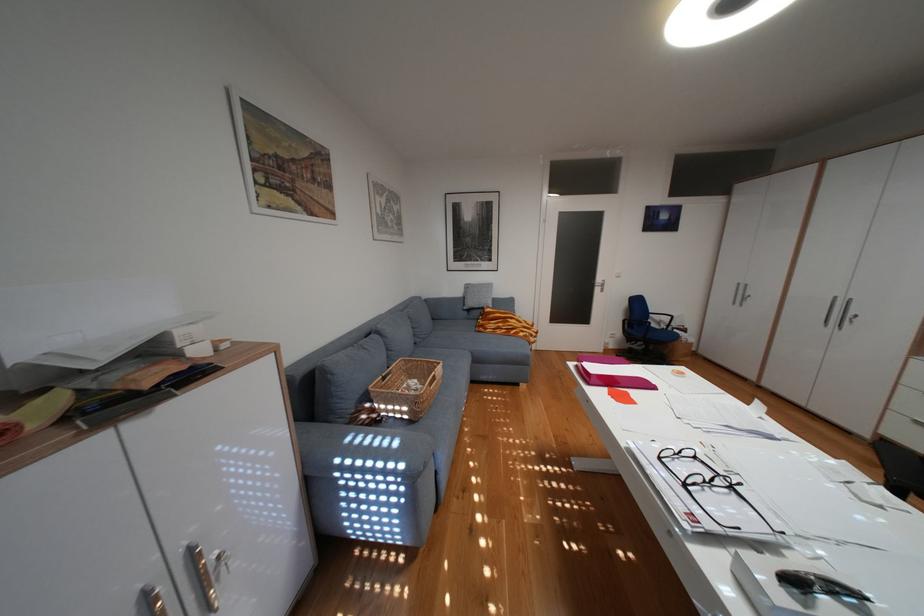
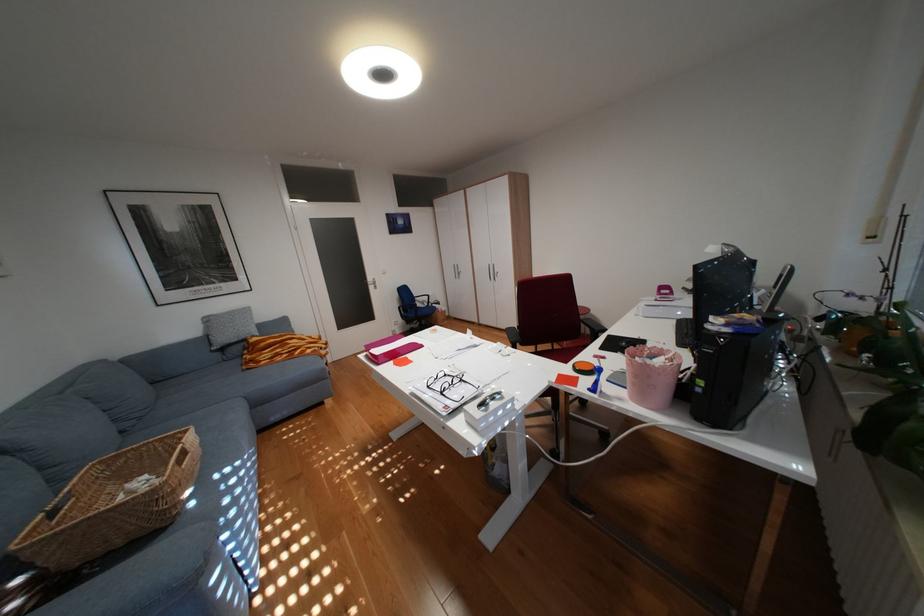
The point at (735, 554) is marked in the first image. Where is the corresponding point in the second image?

(473, 416)